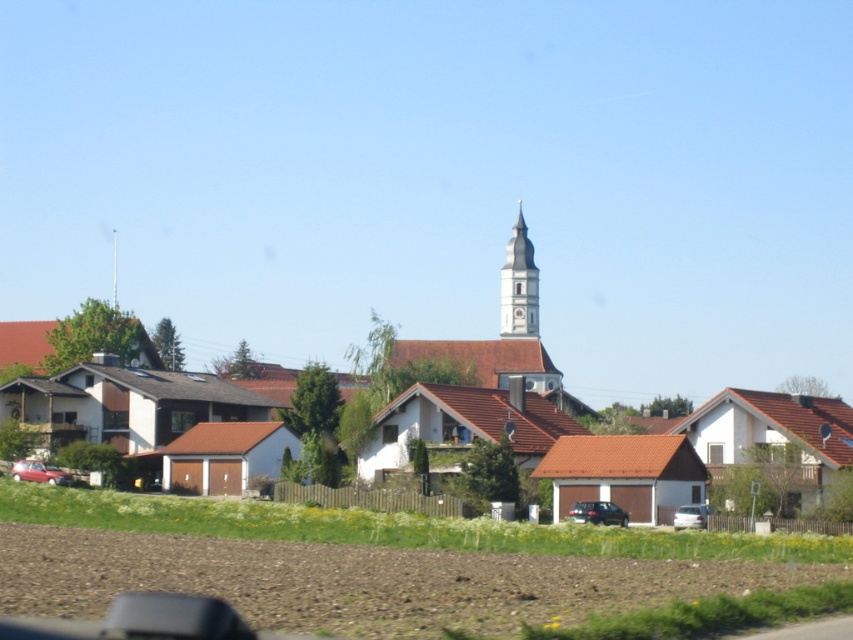
Question: Which object is closer to the camera taking this photo?

Choices:
 (A) white matte house at center
 (B) white stone bell tower at center
 (C) matte red car at lower left

Answer: (A)

Question: Which object appears farthest from the camera in this image?

Choices:
 (A) satin black suv at center
 (B) matte red car at lower left
 (C) white matte car at center
 (D) white stone bell tower at center

Answer: (D)

Question: Estimate the real-world distances between objects in this image. Which object is farther from the white matte house at center?

Choices:
 (A) satin black suv at center
 (B) white matte car at center

Answer: (B)

Question: In this image, where is matte red car at lower left located relative to white matte car at center?

Choices:
 (A) right
 (B) left

Answer: (B)

Question: Does white matte house at center appear on the right side of matte red car at lower left?

Choices:
 (A) no
 (B) yes

Answer: (B)

Question: Does satin black suv at center appear on the left side of matte red car at lower left?

Choices:
 (A) yes
 (B) no

Answer: (B)